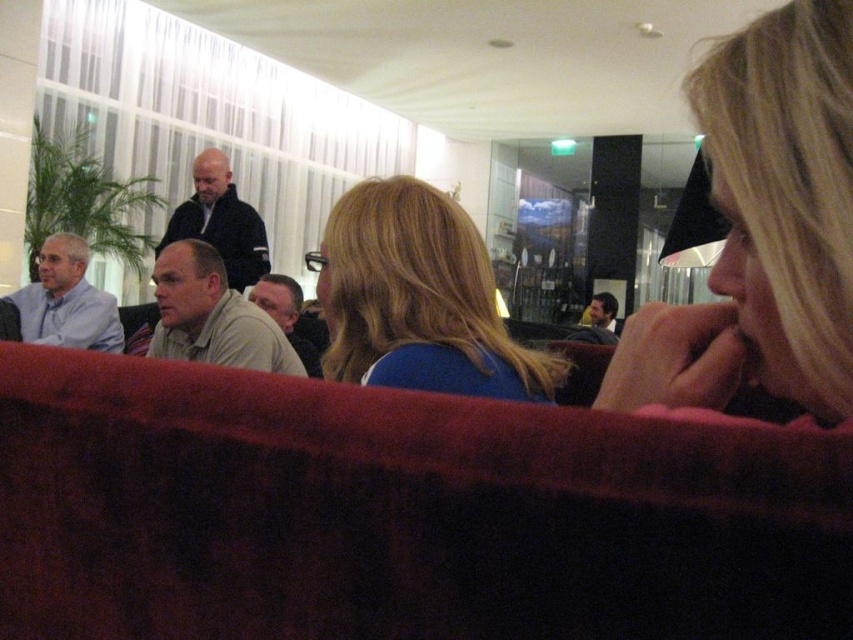
Question: Which object is positioned farthest from the smooth brown leather jacket at center?

Choices:
 (A) matte light blue shirt at left
 (B) blonde hair at upper right
 (C) light beige sweater at center
 (D) light beige shirt at center

Answer: (B)

Question: Which object is positioned closest to the dark blue jacket at upper center?

Choices:
 (A) light beige shirt at center
 (B) light beige sweater at center
 (C) blonde hair at center
 (D) matte light blue shirt at left

Answer: (B)

Question: Is dark blue jacket at upper center below smooth brown leather jacket at center?

Choices:
 (A) yes
 (B) no

Answer: (B)

Question: Which point is closer to the camera?

Choices:
 (A) light beige sweater at center
 (B) blonde hair at upper right
 (C) light beige shirt at center

Answer: (B)

Question: Can you confirm if matte light blue shirt at left is thinner than light beige sweater at center?

Choices:
 (A) yes
 (B) no

Answer: (B)

Question: Is dark blue jacket at upper center further to the viewer compared to light beige sweater at center?

Choices:
 (A) no
 (B) yes

Answer: (B)